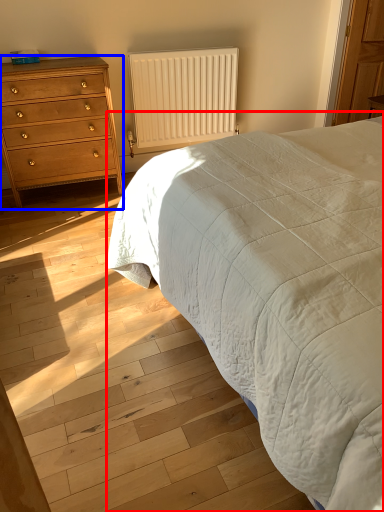
Question: Which point is further to the camera, bed (highlighted by a red box) or chest of drawers (highlighted by a blue box)?

Choices:
 (A) bed
 (B) chest of drawers

Answer: (B)